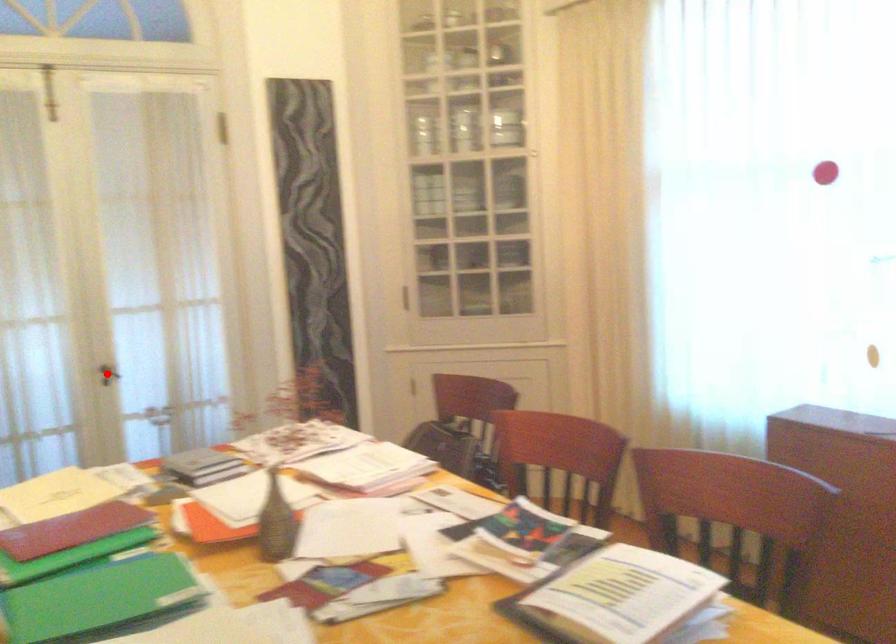
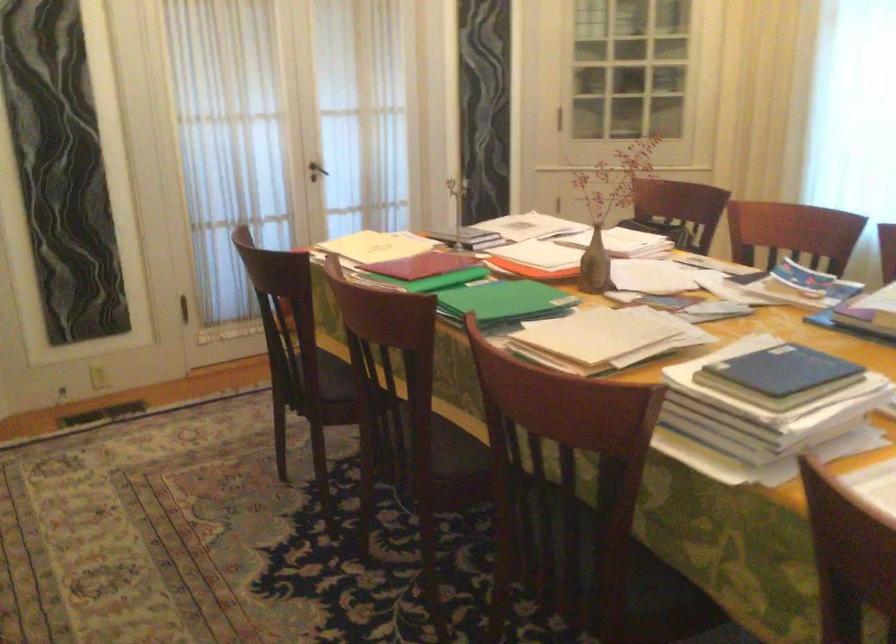
Question: A red point is marked in image1. In image2, is the corresponding 3D point closer to the camera or farther? Reply with the corresponding letter.

Choices:
 (A) The corresponding 3D point is closer.
 (B) The corresponding 3D point is farther.

Answer: (B)